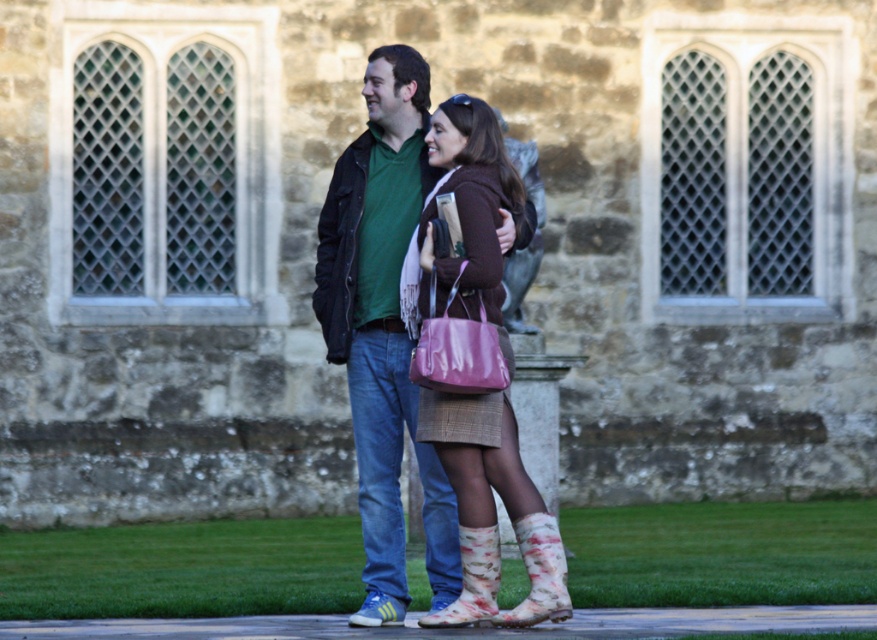
In the scene shown: Is matte green shirt at center positioned in front of matte pink purse at center?

No, matte green shirt at center is behind matte pink purse at center.

Is point (344, 157) more distant than point (426, 404)?

Yes, it is.

This screenshot has width=877, height=640. I want to click on matte green shirt at center, so click(x=376, y=304).

Which is in front, point (336, 211) or point (467, 554)?

Point (467, 554) is more forward.

Is point (418, 61) farther from camera compared to point (466, 557)?

Yes.

The width and height of the screenshot is (877, 640). In order to click on matte green shirt at center in this screenshot , I will do tap(376, 304).

Who is shorter, matte pink purse at center or floral rubber boot at lower center?

With less height is matte pink purse at center.

Is matte pink purse at center positioned behind floral rubber boot at lower center?

No, matte pink purse at center is closer to the viewer.

Is point (498, 396) closer to viewer compared to point (496, 580)?

No, it is not.

Locate an element on the screen. The image size is (877, 640). matte pink purse at center is located at coordinates (492, 509).